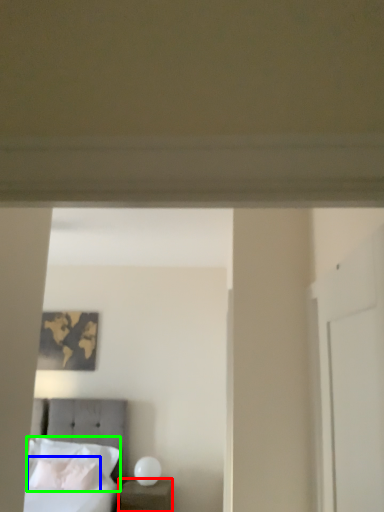
Question: Which object is the farthest from nightstand (highlighted by a red box)? Choose among these: pillow (highlighted by a blue box) or pillow (highlighted by a green box).

Choices:
 (A) pillow
 (B) pillow

Answer: (B)